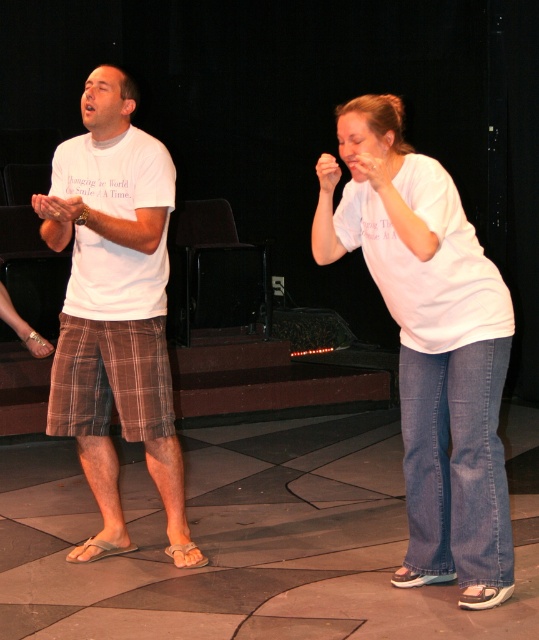
This screenshot has width=539, height=640. What do you see at coordinates (431, 344) in the screenshot?
I see `white cotton shirt at center` at bounding box center [431, 344].

Does white cotton shirt at center have a larger size compared to white t-shirt at left?

No.

Between point (464, 442) and point (119, 280), which one is positioned behind?

The point (119, 280) is more distant.

Find the location of a particular element. This screenshot has width=539, height=640. white cotton shirt at center is located at coordinates (431, 344).